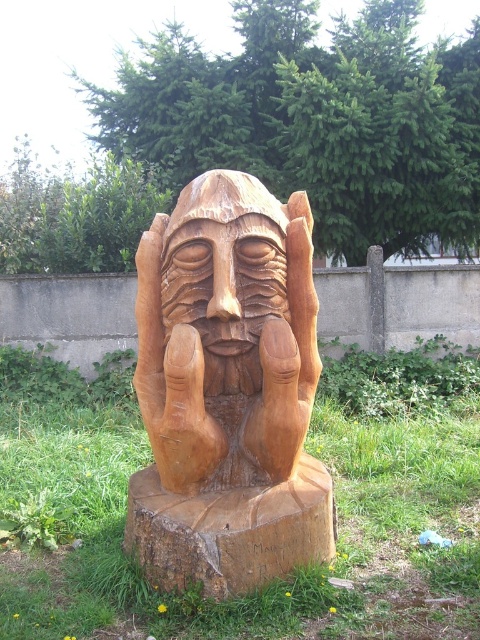
You are standing in the garden and want to take a photo of the wooden carved face at center. However, there is green grass at center blocking your view. Can you move the grass to get a clear shot?

The green grass at center is in front of the wooden carved face at center, so you cannot move the grass since it is part of the environment. You might need to move your position to get a clear view of the wooden carved face at center.

You are an art student examining the wooden sculpture in the garden. You notice two parts of the sculpture labeled as the natural wood carving at center and the wooden carved face at center. From your perspective, which one is positioned to the right?

The natural wood carving at center is positioned to the right of the wooden carved face at center.

You are an artist evaluating the proportions of the sculpture. The natural wood carving at center and the wooden carved face at center are part of the same artwork. Which part is taller?

The natural wood carving at center is taller than the wooden carved face at center.